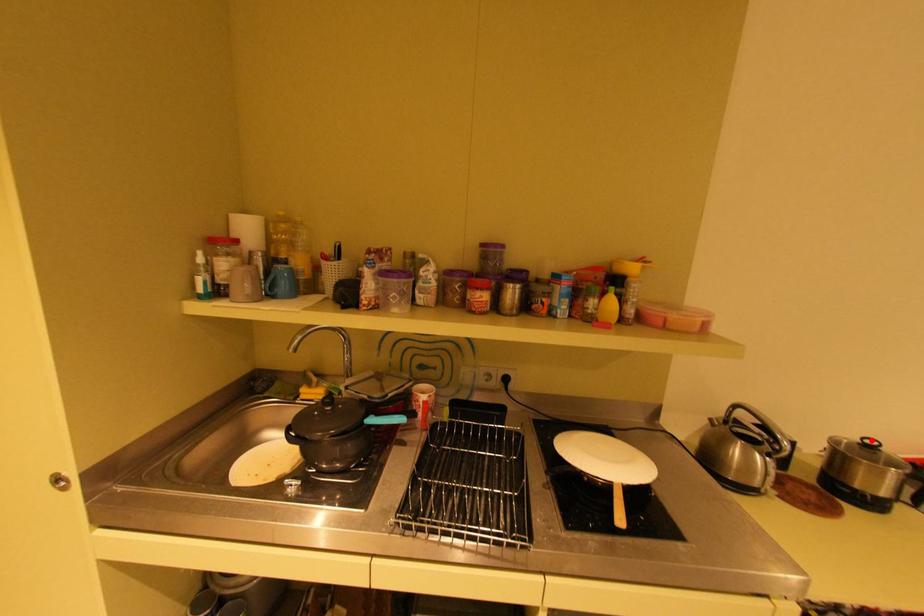
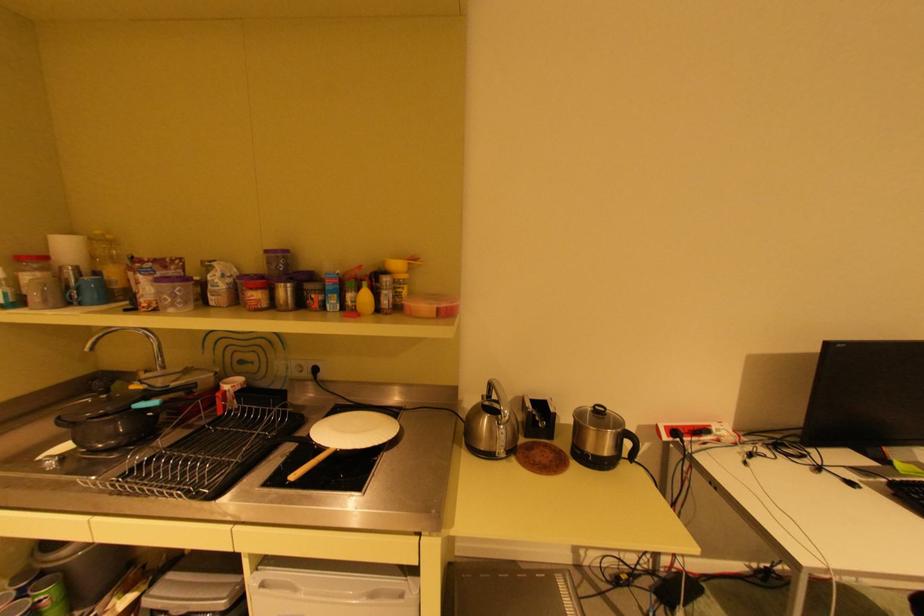
Question: I am providing you with two images of the same scene from different viewpoints. In image1, a red point is highlighted. Considering the same 3D point in image2, which of the following is correct?

Choices:
 (A) It is closer
 (B) It is farther

Answer: (B)